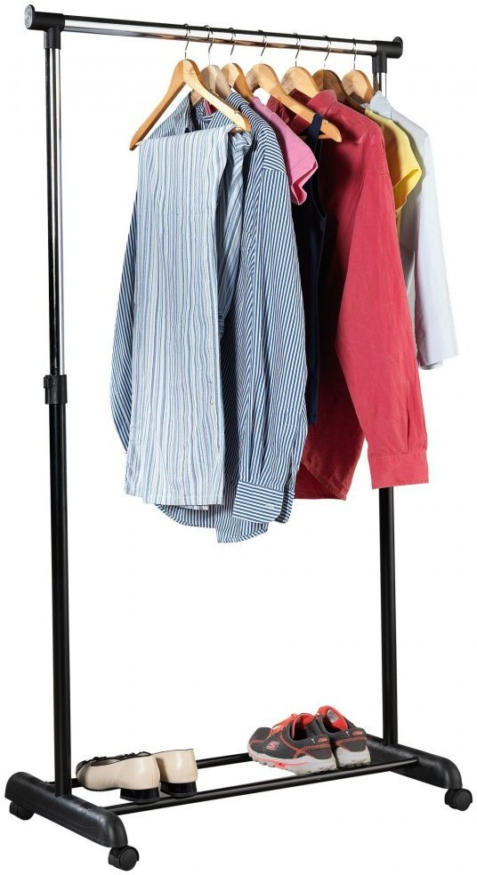
This screenshot has width=477, height=875. I want to click on metal hooks hangers, so click(x=355, y=50), click(x=331, y=45), click(x=300, y=37), click(x=265, y=42), click(x=234, y=33), click(x=211, y=32), click(x=189, y=31).